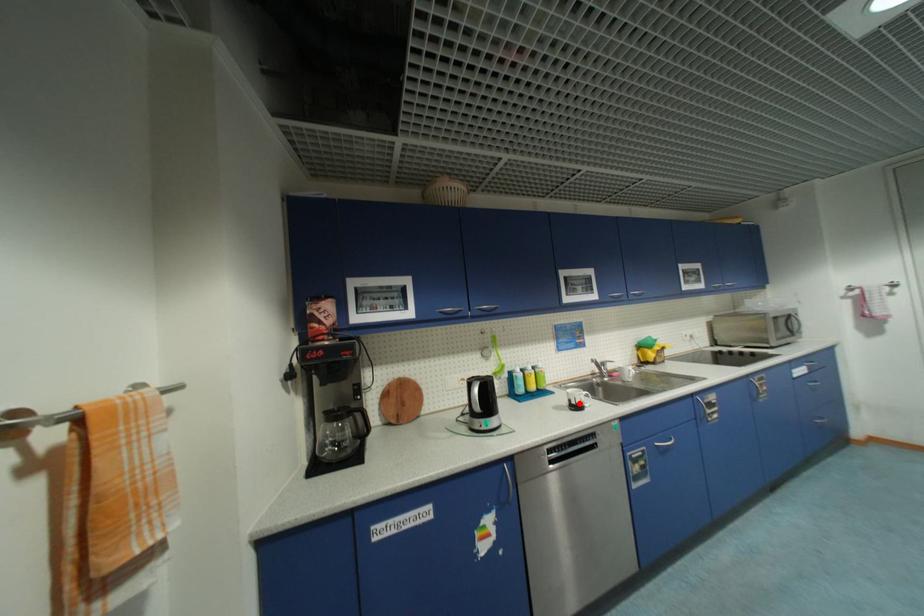
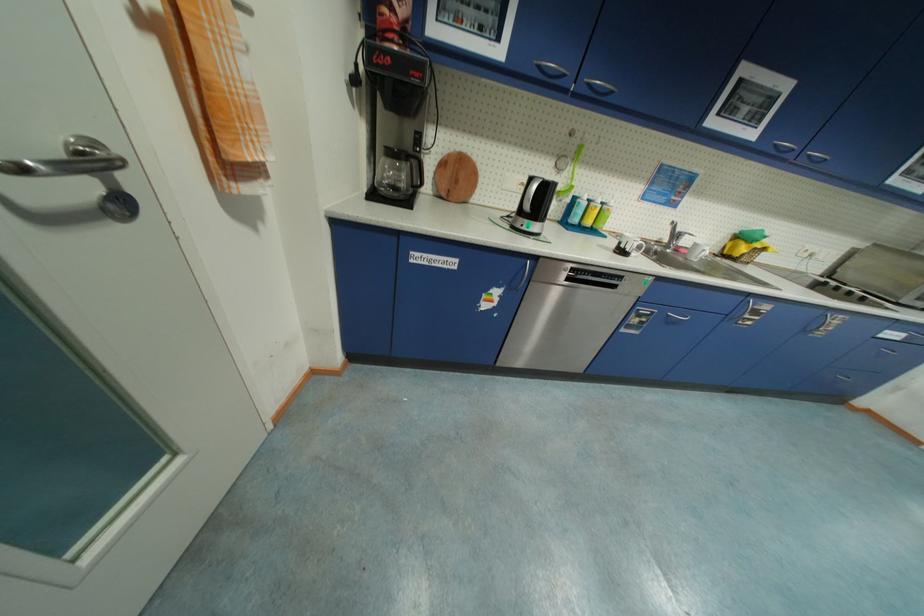
Locate, in the second image, the point that corresponds to the highlighted location in the first image.

(627, 246)